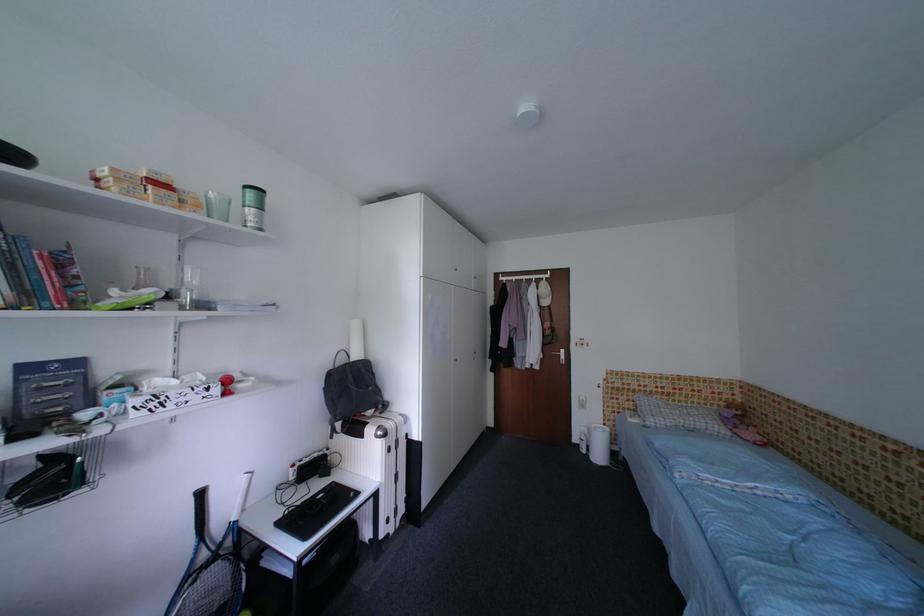
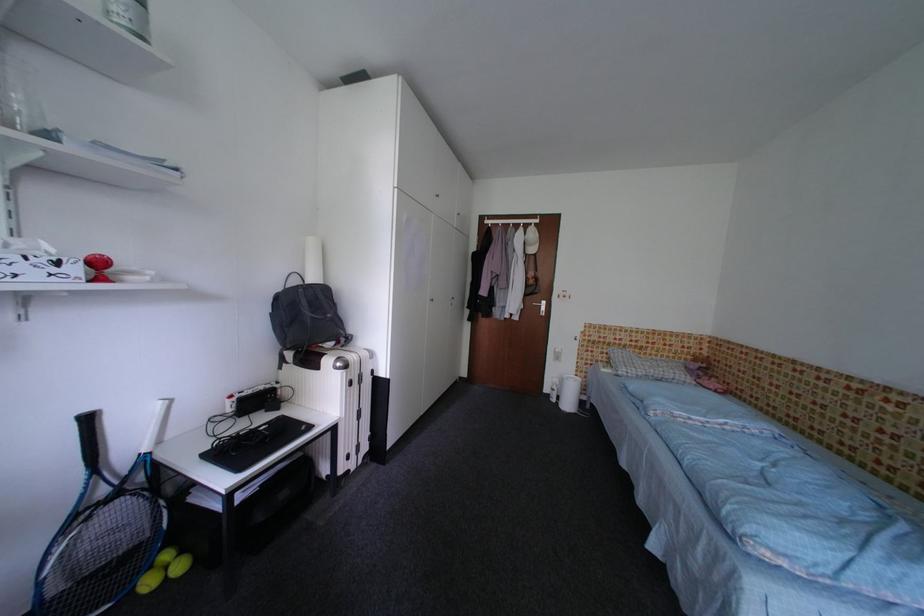
Find the pixel in the second image that matches pixel 209 496 in the first image.

(98, 422)